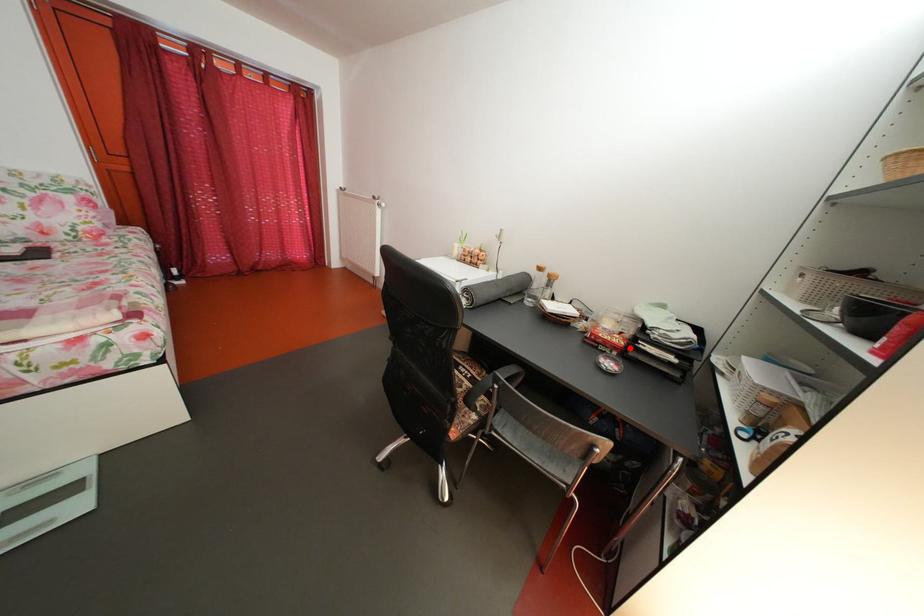
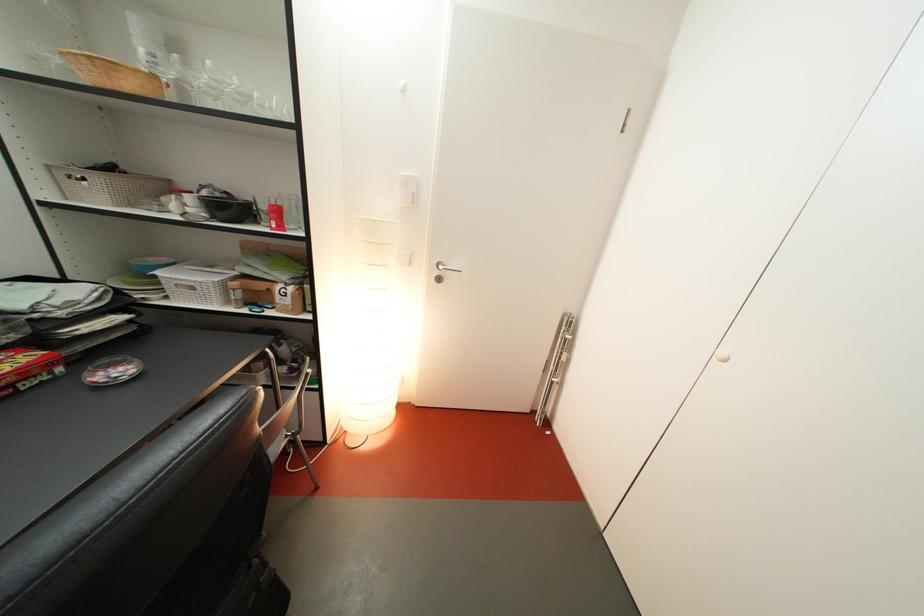
Locate, in the second image, the point that corresponds to the highlighted location in the first image.

(38, 363)